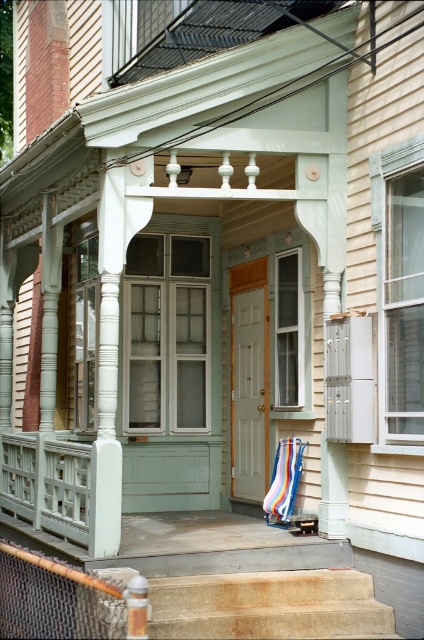
Is point (340, 627) more distant than point (290, 456)?

That is False.

Who is taller, smooth stone stairs at center or striped fabric beach chair at center?

With more height is striped fabric beach chair at center.

Who is more forward, (234, 637) or (281, 483)?

Point (234, 637)

Where is `smooth stone stairs at center`? The width and height of the screenshot is (424, 640). smooth stone stairs at center is located at coordinates (268, 605).